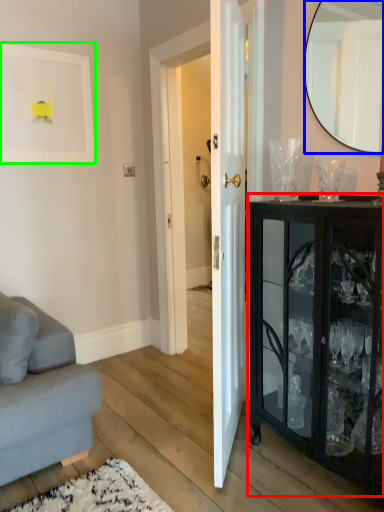
Question: Which object is the closest to the cabinetry (highlighted by a red box)? Choose among these: mirror (highlighted by a blue box) or picture frame (highlighted by a green box).

Choices:
 (A) mirror
 (B) picture frame

Answer: (A)